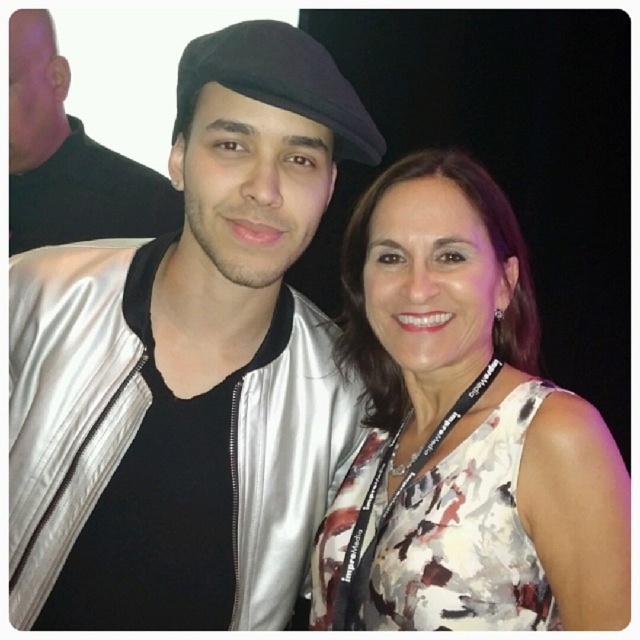
Between point (205, 179) and point (60, 132), which one is positioned in front?

Point (205, 179) is in front.

Is point (173, 410) farther from camera compared to point (35, 237)?

No.

You are a GUI agent. You are given a task and a screenshot of the screen. Output one action in this format:
    pyautogui.click(x=<x>, y=<y>)
    Task: Click on the satin silver jacket at center
    The height and width of the screenshot is (640, 640).
    Given the screenshot: What is the action you would take?
    pyautogui.click(x=188, y=365)

Who is shorter, white printed fabric dress at center or black felt beret at center?

black felt beret at center

Does white printed fabric dress at center appear on the right side of black felt beret at center?

Yes, white printed fabric dress at center is to the right of black felt beret at center.

Who is more distant from viewer, (419,605) or (205,58)?

The point (419,605) is more distant.

Where is `white printed fabric dress at center`? The image size is (640, 640). white printed fabric dress at center is located at coordinates (461, 540).

Is point (493, 522) positioned after point (394, 582)?

That is False.

Find the location of `white floral dress at center`. white floral dress at center is located at coordinates (461, 429).

At what (x,y) coordinates should I click in order to perform the action: click on white floral dress at center. Please return your answer as a coordinate pair (x, y). Image resolution: width=640 pixels, height=640 pixels. Looking at the image, I should click on click(x=461, y=429).